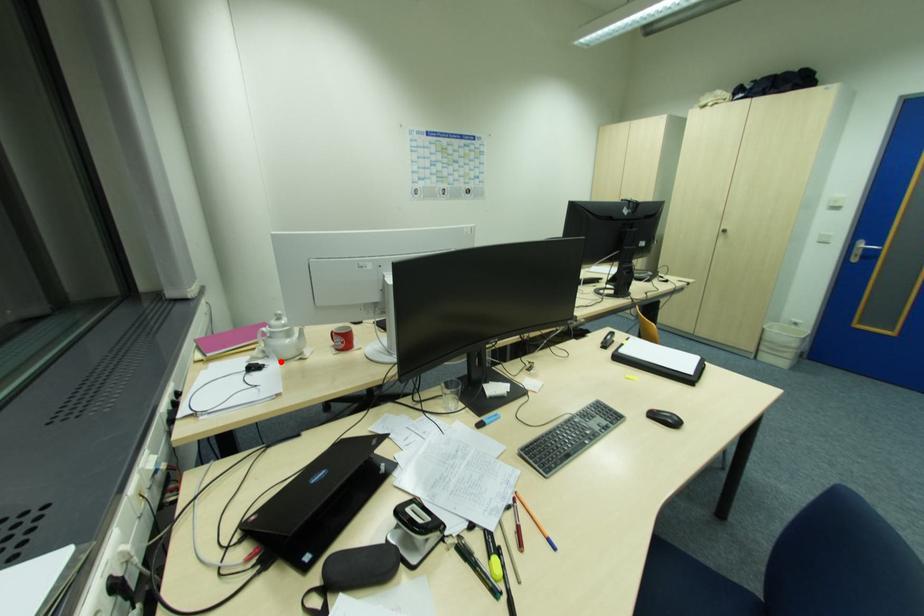
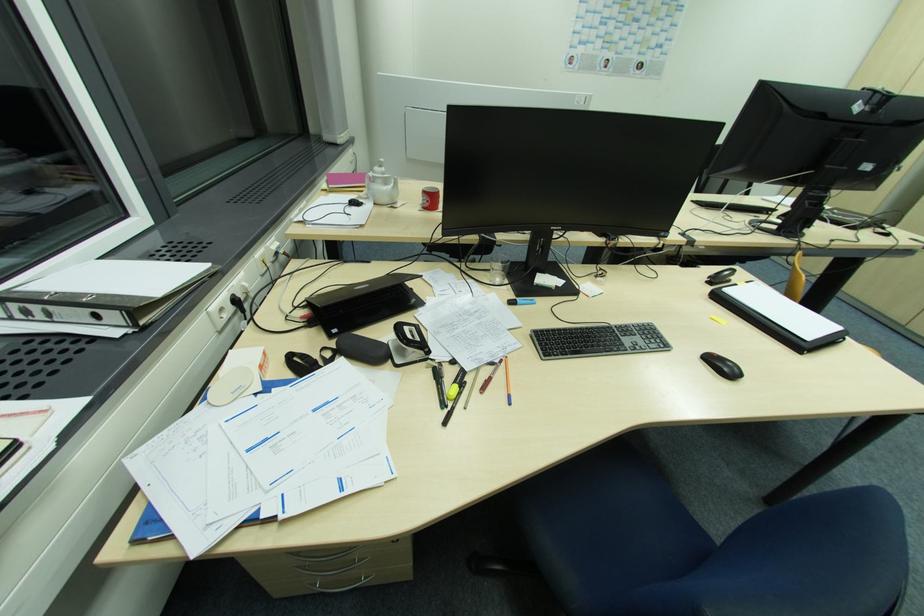
The point at the highlighted location is marked in the first image. Where is the corresponding point in the second image?

(377, 205)